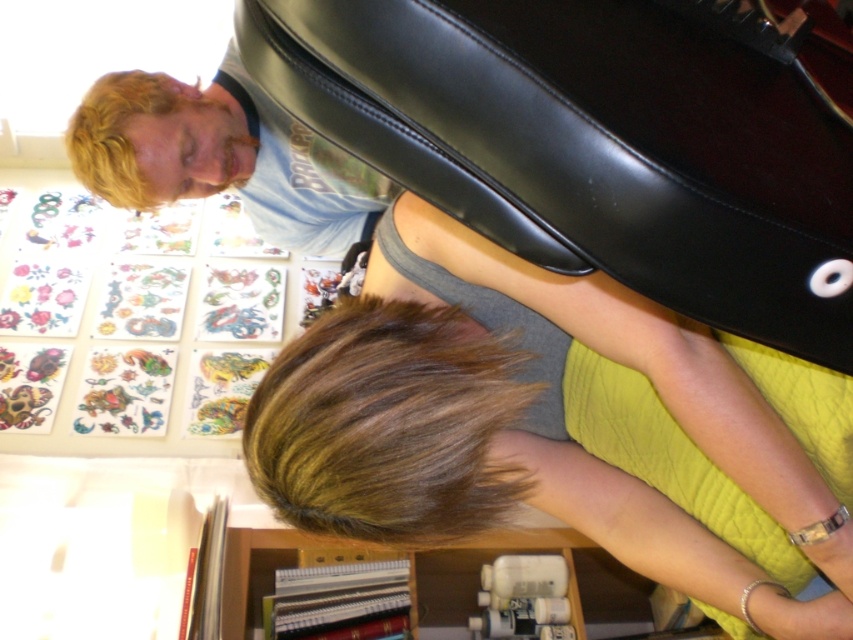
You are a customer in the tattoo parlor. You notice the matte gray tank top at center and the brown shiny hair at lower center. Which object is positioned lower in the image?

The matte gray tank top at center is below the brown shiny hair at lower center, so the matte gray tank top at center is positioned lower in the image.

You are a photographer adjusting your camera settings to capture the scene. You notice the matte gray tank top at center and the brown shiny hair at lower center. Which object is wider in the image?

The matte gray tank top at center is wider than the brown shiny hair at lower center according to the description.

You are a photographer trying to capture a clear shot of the brown shiny hair at lower center and the matte gray tank top at center. Which object should you focus on first if you want to ensure both are in focus?

The matte gray tank top at center is closer to the camera than the brown shiny hair at lower center. To ensure both are in focus, you should focus on the matte gray tank top at center first, as it is closer, and the depth of field may extend to include the brown shiny hair at lower center behind it.